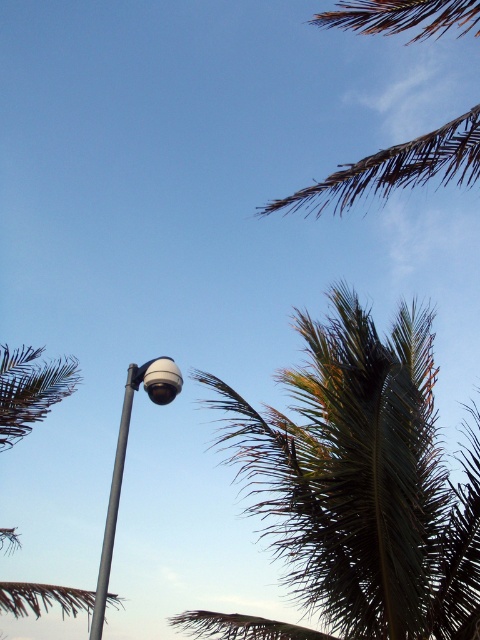
You are standing at the bottom of the streetlamp and want to look up to the top of the green leafy palm at upper left. In which direction should you turn your head?

The green leafy palm at upper left is located at point (x=29, y=388), which is to the upper left direction from the streetlamp. Therefore, you should turn your head towards the upper left direction to look at the top of the green leafy palm at upper left.

You are standing at the base of the metallic gray pole at center and want to place a 3.5 feet wide banner between it and the green leafy palm tree at upper right. Will the banner fit without overlapping either object?

The distance between the green leafy palm tree at upper right and the metallic gray pole at center is 5.27 feet. Since the banner is 3.5 feet wide, it will fit as the space between them is wider than the banner.

You are standing at the base of the tall streetlamp with a spherical lampshade at its top, which is slightly off to the left. You want to look at the point marked at coordinates point (363, 481). Which direction should you turn to face that point?

You should turn to your right to face the point (363, 481) because it is on the green leafy palm tree at upper right, which is located to your right side relative to the streetlamp.